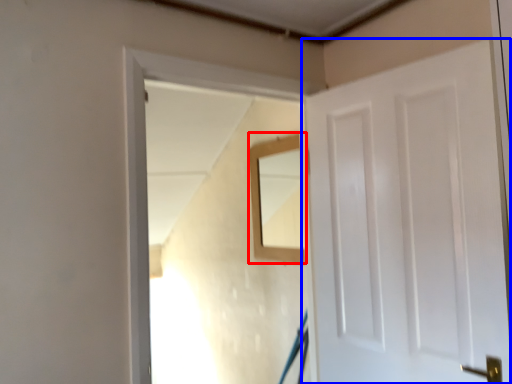
Question: Which object appears farthest to the camera in this image, mirror (highlighted by a red box) or door (highlighted by a blue box)?

Choices:
 (A) mirror
 (B) door

Answer: (A)